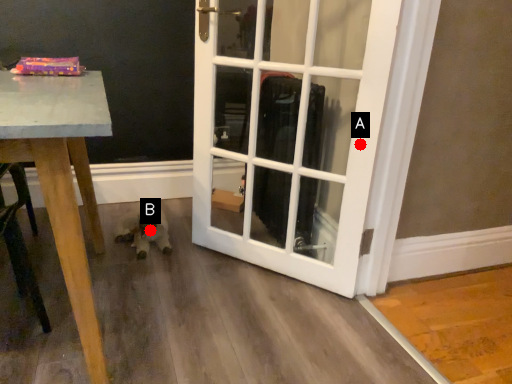
Question: Two points are circled on the image, labeled by A and B beside each circle. Among these points, which one is nearest to the camera?

Choices:
 (A) A is closer
 (B) B is closer

Answer: (A)